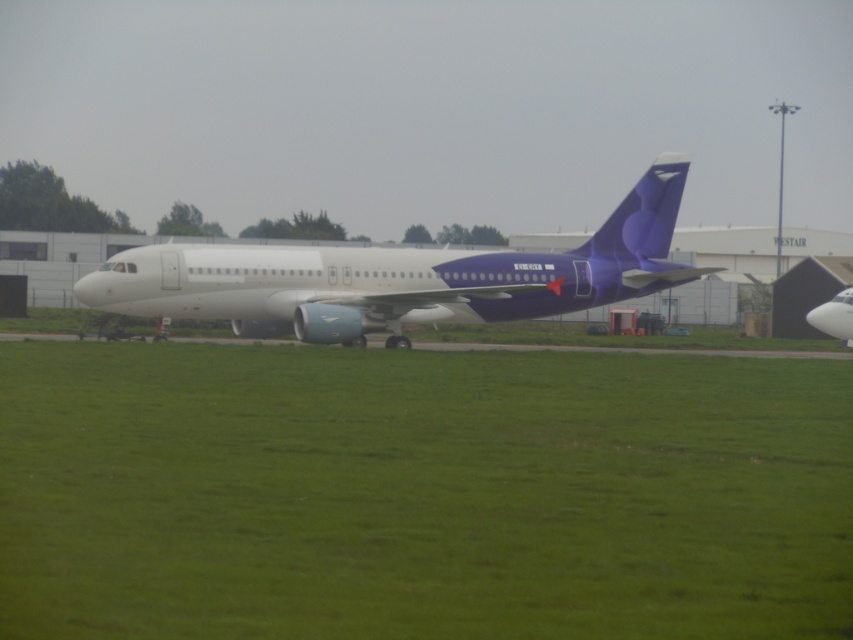
You are a pilot checking the safety of the tarmac before boarding. You notice the green grass at center and the white matte airplane at center. Which one has a greater height?

The white matte airplane at center is taller than the green grass at center.

You are standing on the tarmac and see the green grass at center and the white glossy airplane at center. Which object is positioned to the left of the other?

The green grass at center is to the left of the white glossy airplane at center.

Based on the photo, you are a maintenance worker needing to reach the white glossy airplane at center from the green grass at center. Given that your tool cart can only move on solid ground, can you safely traverse the space between them?

The distance between the green grass at center and the white glossy airplane at center is 44.21 feet, so yes, you can safely traverse the space between them since the tool cart can move on solid ground and the airplane is parked on a paved surface.